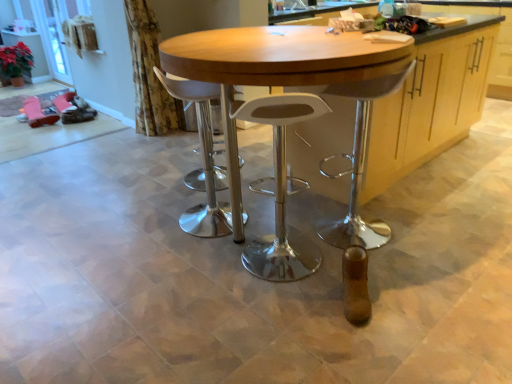
Locate an element on the screen. vacant space situated on the left part of white plastic stool at center, marked as the 1th stool in a left-to-right arrangement is located at coordinates (144, 226).